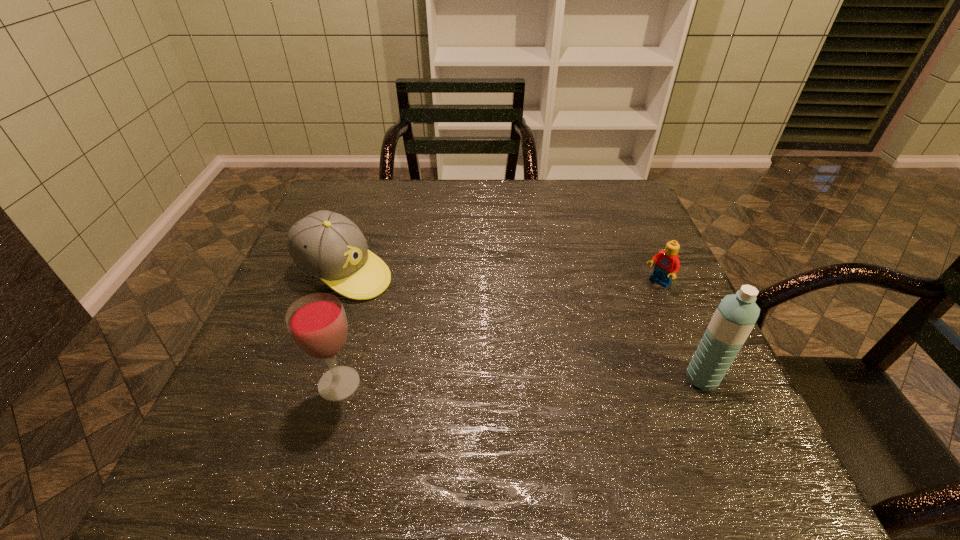
Locate an element on the screen. The width and height of the screenshot is (960, 540). wineglass is located at coordinates (317, 323).

Find the location of a particular element. This screenshot has width=960, height=540. water bottle is located at coordinates (736, 315).

Identify the location of baseball cap. (326, 245).

Find the location of a particular element. The image size is (960, 540). Lego is located at coordinates (667, 264).

Where is `vacant space located 0.310m on the back of the wineglass`? vacant space located 0.310m on the back of the wineglass is located at coordinates (372, 264).

At what (x,y) coordinates should I click in order to perform the action: click on vacant space located on the back of the water bottle. Please return your answer as a coordinate pair (x, y). Looking at the image, I should click on (683, 334).

Where is `vacant region located 0.400m on the front-facing side of the third tallest object`? This screenshot has height=540, width=960. vacant region located 0.400m on the front-facing side of the third tallest object is located at coordinates (529, 365).

Find the location of a particular element. This screenshot has width=960, height=540. vacant space positioned 0.260m on the front-facing side of the third tallest object is located at coordinates (471, 335).

The height and width of the screenshot is (540, 960). Identify the location of vacant area located on the front-facing side of the third tallest object. (420, 309).

Locate an element on the screen. This screenshot has width=960, height=540. free space located 0.320m on the face of the Lego is located at coordinates (553, 356).